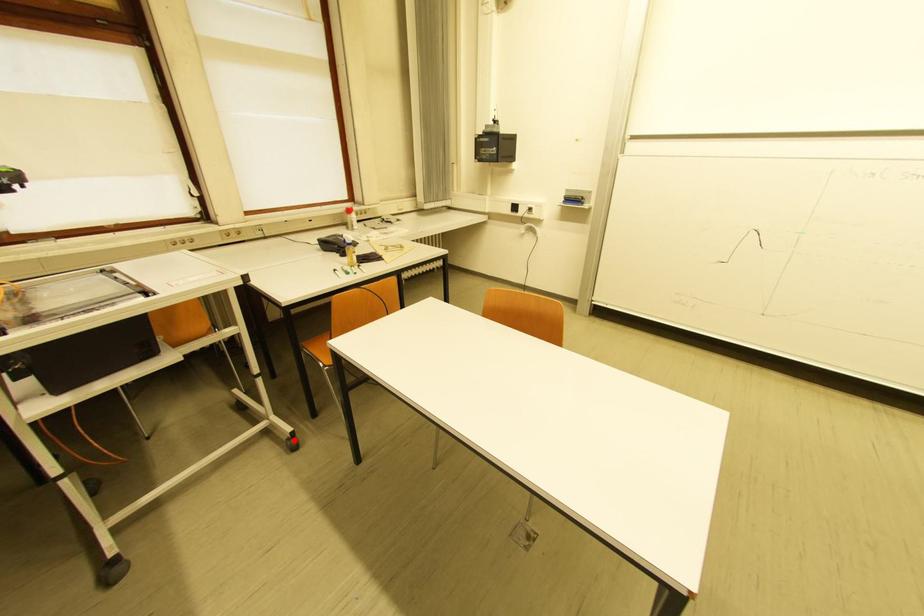
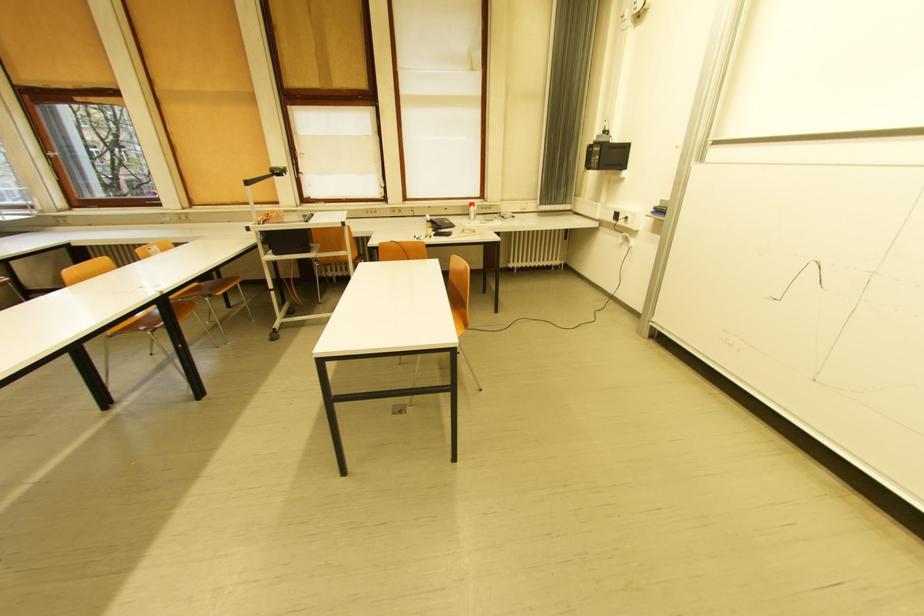
Question: I am providing you with two images of the same scene from different viewpoints. A red point is marked on the first image. At the location where the point appears in image 1, is it still visible in image 2?

Choices:
 (A) Yes
 (B) No

Answer: (B)